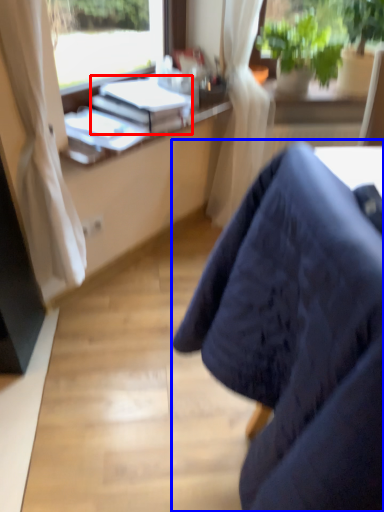
Question: Which of the following is the closest to the observer, book (highlighted by a red box) or chair (highlighted by a blue box)?

Choices:
 (A) book
 (B) chair

Answer: (B)